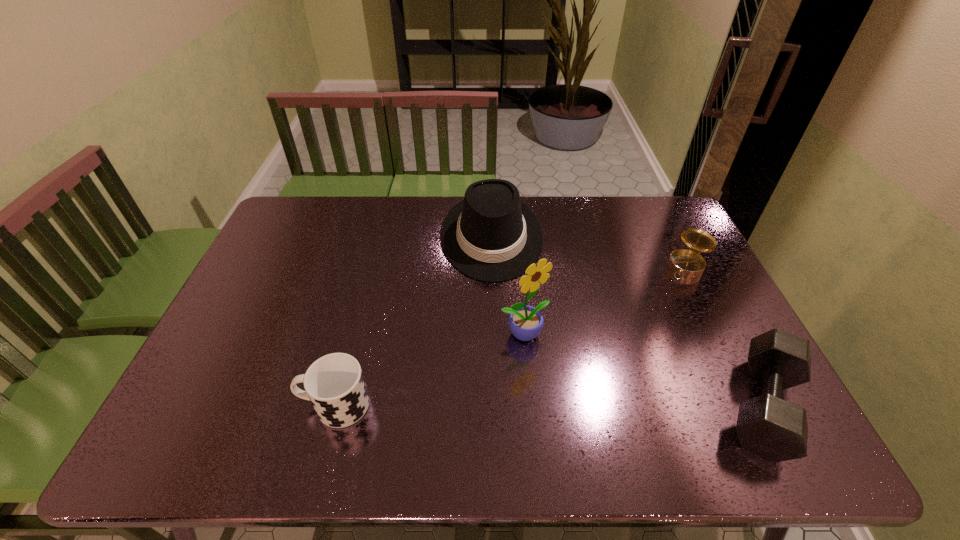
Locate an element on the screen. vacant spot on the desktop that is between the leftmost object and the dumbbell and is positioned on the front-facing side of the fedora is located at coordinates (503, 405).

The width and height of the screenshot is (960, 540). What are the coordinates of `vacant space on the desktop that is between the cup and the dumbbell and is positioned on the front-facing side of the sunflower` in the screenshot? It's located at (591, 406).

Find the location of a particular element. Image resolution: width=960 pixels, height=540 pixels. vacant space on the desktop that is between the leftmost object and the dumbbell and is positioned with the dial facing the compass is located at coordinates (590, 406).